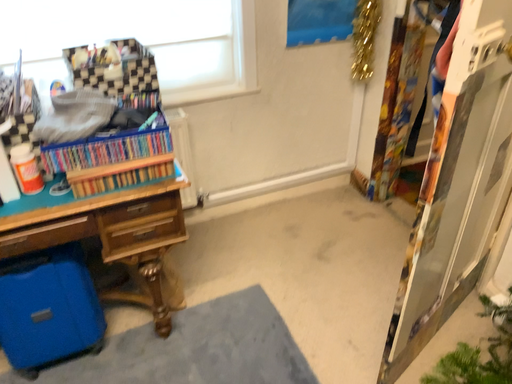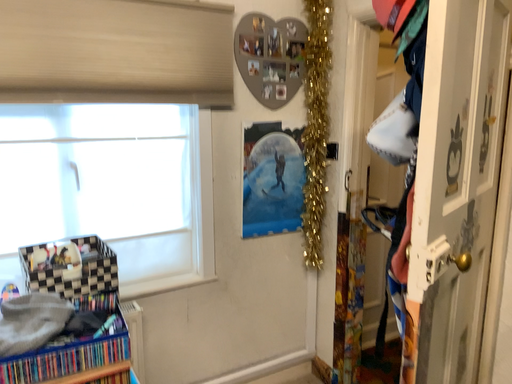
Question: How did the camera likely rotate when shooting the video?

Choices:
 (A) rotated upward
 (B) rotated downward

Answer: (A)